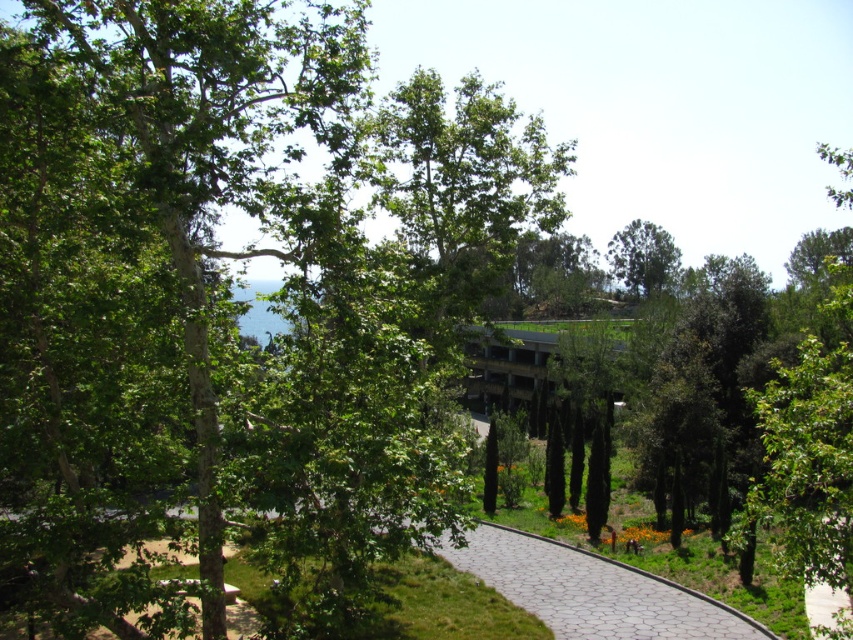
Based on the scene description, where is the green leafy tree at left located in terms of its 2D coordinates?

The green leafy tree at left is located at the 2D coordinates of point (x=178, y=205).

You are a landscape architect designing a walking path. You need to ensure that the green leafy tree at left and the green leafy tree at upper center are visible from the path. Given their sizes, which tree might require more strategic placement to ensure visibility?

The green leafy tree at left is wider than the green leafy tree at upper center, so it might require more strategic placement to ensure visibility from the path since its larger width could block the view more easily.

You are a hiker walking along the paved stone path at center and want to reach the green leafy tree at left. Is the tree visible from your current position on the path?

The green leafy tree at left is in front of the paved stone path at center, so yes, the tree is visible from the path.